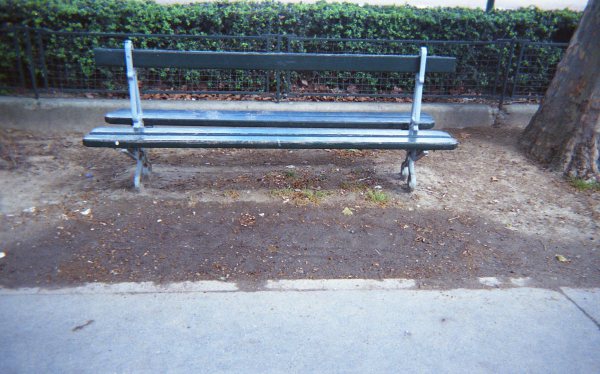
Locate an element on the screen. bench legs is located at coordinates (412, 172), (402, 169), (137, 175), (147, 166).